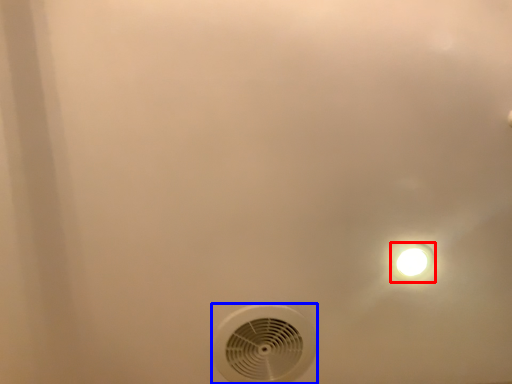
Question: Which object appears closest to the camera in this image, light fixture (highlighted by a red box) or mechanical fan (highlighted by a blue box)?

Choices:
 (A) light fixture
 (B) mechanical fan

Answer: (A)